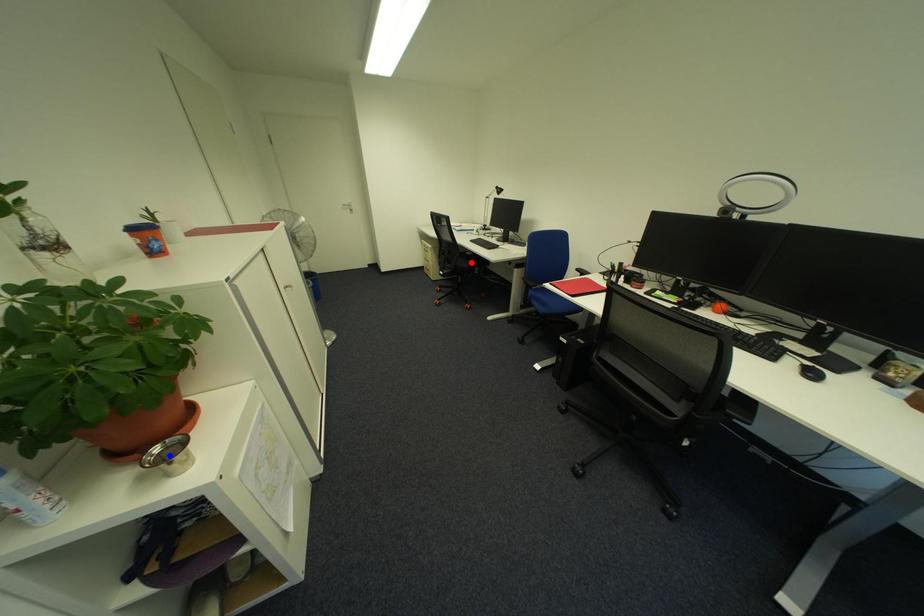
Question: Which of the two points in the image is closer to the camera?

Choices:
 (A) Blue point is closer.
 (B) Red point is closer.

Answer: (A)